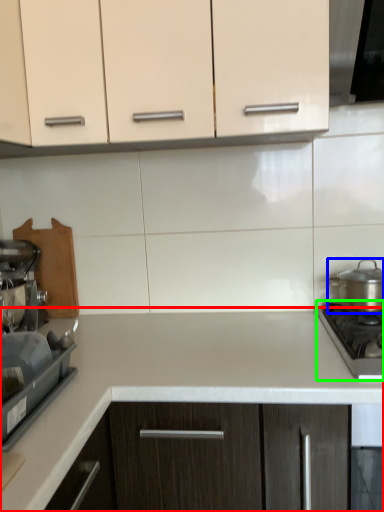
Question: Considering the real-world distances, which object is farthest from countertop (highlighted by a red box)? kitchen appliance (highlighted by a blue box) or gas stove (highlighted by a green box)?

Choices:
 (A) kitchen appliance
 (B) gas stove

Answer: (A)